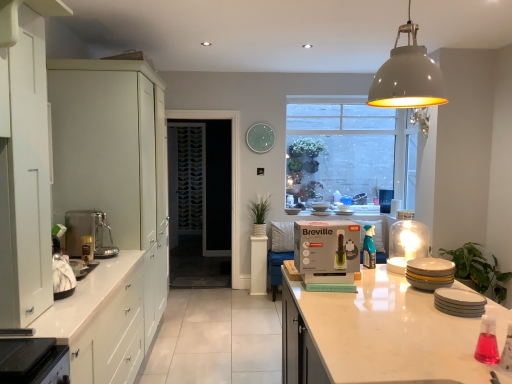
Where is `white glossy countertop at lower left, arranged as the 2th countertop when viewed from the right`? white glossy countertop at lower left, arranged as the 2th countertop when viewed from the right is located at coordinates (102, 322).

At what (x,y) coordinates should I click in order to perform the action: click on satin silver coffee machine at left. Please return your answer as a coordinate pair (x, y). This screenshot has height=384, width=512. Looking at the image, I should click on (87, 233).

How much space does green leafy plant at right, arranged as the second plant when viewed from the top, occupy horizontally?

green leafy plant at right, arranged as the second plant when viewed from the top, is 15.49 inches in width.

Image resolution: width=512 pixels, height=384 pixels. What do you see at coordinates (260, 209) in the screenshot? I see `green matte plant at center, marked as the second plant in a front-to-back arrangement` at bounding box center [260, 209].

Identify the location of translucent plastic spray bottle at center. Image resolution: width=512 pixels, height=384 pixels. (369, 248).

Describe the element at coordinates (85, 200) in the screenshot. The image size is (512, 384). I see `matte white cabinets at left, the first cabinetry positioned from the back` at that location.

I want to click on matte white cabinets at left, which appears as the second cabinetry when viewed from the front, so 85,200.

Identify the location of green matte breville box at center. This screenshot has height=384, width=512. (326, 247).

From the image's perspective, which one is positioned lower, white matte cabinet at left, acting as the second cabinetry starting from the back, or white glossy countertop at lower left, marked as the first countertop in a front-to-back arrangement?

white glossy countertop at lower left, marked as the first countertop in a front-to-back arrangement, is shown below in the image.

Can you tell me how much white matte cabinet at left, acting as the second cabinetry starting from the back, and white glossy countertop at lower left, which is the 2th countertop in back-to-front order, differ in facing direction?

There is a 0.154-degree angle between the facing directions of white matte cabinet at left, acting as the second cabinetry starting from the back, and white glossy countertop at lower left, which is the 2th countertop in back-to-front order.

Could white glossy countertop at lower left, which is the 2th countertop in back-to-front order, be considered to be inside white matte cabinet at left, acting as the second cabinetry starting from the back?

No, white glossy countertop at lower left, which is the 2th countertop in back-to-front order, is located outside of white matte cabinet at left, acting as the second cabinetry starting from the back.

Find the location of a particular element. The width and height of the screenshot is (512, 384). cabinetry that is on the right side of white glossy countertop at lower left, arranged as the 2th countertop when viewed from the right is located at coordinates (24, 161).

In the scene shown: Considering the relative sizes of white glossy countertop at lower left, arranged as the 2th countertop when viewed from the right, and satin silver coffee machine at left in the image provided, is white glossy countertop at lower left, arranged as the 2th countertop when viewed from the right, bigger than satin silver coffee machine at left?

Indeed, white glossy countertop at lower left, arranged as the 2th countertop when viewed from the right, has a larger size compared to satin silver coffee machine at left.

Is white glossy countertop at lower left, marked as the first countertop in a front-to-back arrangement, turned away from satin silver coffee machine at left?

No, white glossy countertop at lower left, marked as the first countertop in a front-to-back arrangement,'s orientation is not away from satin silver coffee machine at left.

Does white glossy countertop at lower left, marked as the first countertop in a front-to-back arrangement, have a greater height compared to satin silver coffee machine at left?

Yes.

Is white glossy countertop at lower center, positioned as the 1th countertop in right-to-left order, facing away from satin silver coffee machine at left?

No, white glossy countertop at lower center, positioned as the 1th countertop in right-to-left order, is not facing away from satin silver coffee machine at left.

Considering the points (341, 360) and (96, 212), which point is behind, point (341, 360) or point (96, 212)?

The point (96, 212) is behind.

How different are the orientations of white glossy countertop at lower center, positioned as the 1th countertop in right-to-left order, and satin silver coffee machine at left in degrees?

The facing directions of white glossy countertop at lower center, positioned as the 1th countertop in right-to-left order, and satin silver coffee machine at left are 179 degrees apart.

Is white glossy countertop at lower center, acting as the first countertop starting from the back, far away from satin silver coffee machine at left?

That's right, there is a large distance between white glossy countertop at lower center, acting as the first countertop starting from the back, and satin silver coffee machine at left.

From the green leafy plant at right, placed as the 1th plant when sorted from front to back, count 1st countertops forward and point to it. Please provide its 2D coordinates.

[(378, 335)]

Which object is closer to the camera taking this photo, green leafy plant at right, the 2th plant in the left-to-right sequence, or white glossy countertop at lower center, acting as the first countertop starting from the back?

white glossy countertop at lower center, acting as the first countertop starting from the back.

From the image's perspective, is green leafy plant at right, placed as the 1th plant when sorted from front to back, over white glossy countertop at lower center, positioned as the 1th countertop in right-to-left order?

Yes, from the image's perspective, green leafy plant at right, placed as the 1th plant when sorted from front to back, is over white glossy countertop at lower center, positioned as the 1th countertop in right-to-left order.

Which of these two, green leafy plant at right, the second plant when ordered from back to front, or white glossy countertop at lower center, which is counted as the second countertop, starting from the front, is thinner?

Thinner between the two is green leafy plant at right, the second plant when ordered from back to front.

Would you consider clear glass window at upper center to be distant from white matte cabinet at left, acting as the second cabinetry starting from the back?

That's right, there is a large distance between clear glass window at upper center and white matte cabinet at left, acting as the second cabinetry starting from the back.

Identify the location of window on the right of white matte cabinet at left, placed as the 1th cabinetry when sorted from front to back. (349, 154).

From a real-world perspective, is clear glass window at upper center below white matte cabinet at left, placed as the 1th cabinetry when sorted from front to back?

No, from a real-world perspective, clear glass window at upper center is not under white matte cabinet at left, placed as the 1th cabinetry when sorted from front to back.

Looking at their sizes, would you say clear glass window at upper center is wider or thinner than white matte cabinet at left, acting as the second cabinetry starting from the back?

Considering their sizes, clear glass window at upper center looks slimmer than white matte cabinet at left, acting as the second cabinetry starting from the back.

Considering the positions of point (24, 273) and point (310, 269), is point (24, 273) closer or farther from the camera than point (310, 269)?

Point (24, 273) is positioned closer to the camera compared to point (310, 269).

From the image's perspective, does white matte cabinet at left, placed as the 1th cabinetry when sorted from front to back, appear lower than green matte breville box at center?

No, from the image's perspective, white matte cabinet at left, placed as the 1th cabinetry when sorted from front to back, is not beneath green matte breville box at center.

Could you measure the distance between white matte cabinet at left, acting as the second cabinetry starting from the back, and green matte breville box at center?

They are 1.33 meters apart.

Is white matte cabinet at left, placed as the 1th cabinetry when sorted from front to back, in front of green matte breville box at center?

Yes, white matte cabinet at left, placed as the 1th cabinetry when sorted from front to back, is closer to the camera.

Is the position of patterned glass screen door at center more distant than that of translucent plastic spray bottle at center?

Yes, patterned glass screen door at center is behind translucent plastic spray bottle at center.

Could you tell me if patterned glass screen door at center is facing translucent plastic spray bottle at center?

No, patterned glass screen door at center does not turn towards translucent plastic spray bottle at center.

From the picture: Can you confirm if patterned glass screen door at center is smaller than translucent plastic spray bottle at center?

Actually, patterned glass screen door at center might be larger than translucent plastic spray bottle at center.

Is there a large distance between patterned glass screen door at center and translucent plastic spray bottle at center?

Yes, patterned glass screen door at center and translucent plastic spray bottle at center are quite far apart.

The height and width of the screenshot is (384, 512). What are the coordinates of `cabinetry in front of the white glossy countertop at lower left, which appears as the 1th countertop when viewed from the left` in the screenshot? It's located at (24, 161).

Find the location of a particular element. This screenshot has width=512, height=384. coffee machine that is above the white glossy countertop at lower left, arranged as the 2th countertop when viewed from the right (from a real-world perspective) is located at coordinates (87, 233).

From the image, which object appears to be nearer to white glossy plates at right, which is the first appliance in front-to-back order, clear glass window at upper center or matte ceramic plates at right, marked as the second appliance in a back-to-front arrangement?

The object closer to white glossy plates at right, which is the first appliance in front-to-back order, is matte ceramic plates at right, marked as the second appliance in a back-to-front arrangement.

From the image, which object appears to be farther from white matte cabinet at left, acting as the second cabinetry starting from the back, satin silver coffee machine at left or patterned glass screen door at center?

Among the two, patterned glass screen door at center is located further to white matte cabinet at left, acting as the second cabinetry starting from the back.

Based on their spatial positions, is green leafy plant at right, placed as the 1th plant when sorted from front to back, or translucent plastic spray bottle at center closer to green matte plant at center, which is the first plant from top to bottom?

Based on the image, green leafy plant at right, placed as the 1th plant when sorted from front to back, appears to be nearer to green matte plant at center, which is the first plant from top to bottom.

Based on their spatial positions, is patterned glass screen door at center or white matte cabinet at left, acting as the second cabinetry starting from the back, closer to white glossy countertop at lower left, marked as the first countertop in a front-to-back arrangement?

The object closer to white glossy countertop at lower left, marked as the first countertop in a front-to-back arrangement, is white matte cabinet at left, acting as the second cabinetry starting from the back.

From the image, which object appears to be farther from green matte breville box at center, white glossy countertop at lower left, which appears as the 1th countertop when viewed from the left, or translucent glass dome at upper right, acting as the first appliance starting from the back?

white glossy countertop at lower left, which appears as the 1th countertop when viewed from the left.

Estimate the real-world distances between objects in this image. Which object is further from white glossy countertop at lower center, acting as the first countertop starting from the back, matte gray dome at upper center or satin silver coffee machine at left?

Based on the image, satin silver coffee machine at left appears to be further to white glossy countertop at lower center, acting as the first countertop starting from the back.

From the image, which object appears to be farther from matte ceramic plates at right, marked as the second appliance in a back-to-front arrangement, green matte plant at center, marked as the second plant in a front-to-back arrangement, or green leafy plant at right, the 2th plant in the left-to-right sequence?

green matte plant at center, marked as the second plant in a front-to-back arrangement, is positioned further to the anchor matte ceramic plates at right, marked as the second appliance in a back-to-front arrangement.

When comparing their distances from green matte breville box at center, does white glossy countertop at lower left, which is the 2th countertop in back-to-front order, or matte white cabinets at left, which appears as the second cabinetry when viewed from the front, seem closer?

Among the two, white glossy countertop at lower left, which is the 2th countertop in back-to-front order, is located nearer to green matte breville box at center.

The height and width of the screenshot is (384, 512). What are the coordinates of `cardboard box between white glossy plates at right, the third appliance in the back-to-front sequence, and clear glass window at upper center in the front-back direction` in the screenshot? It's located at (326, 247).

In order to click on cabinetry situated between satin silver coffee machine at left and matte gray dome at upper center from left to right in this screenshot , I will do (24, 161).

You are a GUI agent. You are given a task and a screenshot of the screen. Output one action in this format:
    pyautogui.click(x=<x>, y=<y>)
    Task: Click on the countertop between translucent glass dome at upper right, acting as the first appliance starting from the back, and patterned glass screen door at center from front to back
    The width and height of the screenshot is (512, 384).
    Given the screenshot: What is the action you would take?
    pyautogui.click(x=378, y=335)

The width and height of the screenshot is (512, 384). I want to click on coffee machine between matte white cabinets at left, which appears as the second cabinetry when viewed from the front, and white glossy countertop at lower center, marked as the second countertop in a left-to-right arrangement, so click(x=87, y=233).